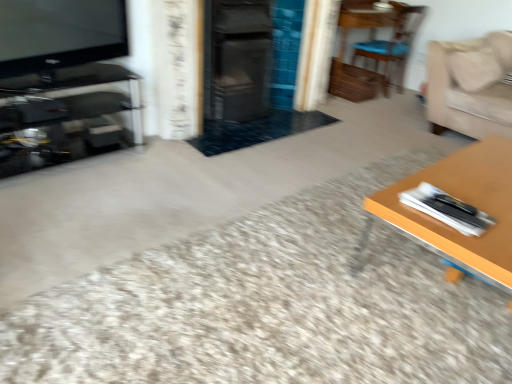
Describe the element at coordinates (470, 85) in the screenshot. I see `beige fabric couch at upper right` at that location.

This screenshot has height=384, width=512. What do you see at coordinates (62, 79) in the screenshot?
I see `black glass entertainment center at left` at bounding box center [62, 79].

Where is `wooden chair at upper right`? This screenshot has height=384, width=512. wooden chair at upper right is located at coordinates (393, 46).

Would you say wooden chair at upper right is a long distance from wooden table at right?

Indeed, wooden chair at upper right is not near wooden table at right.

Which object is positioned more to the right, wooden chair at upper right or wooden table at right?

wooden chair at upper right is more to the right.

Is wooden chair at upper right not within wooden table at right?

Yes, wooden chair at upper right is located beyond the bounds of wooden table at right.

Who is taller, wooden chair at upper right or wooden table at right?

wooden chair at upper right is taller.

Is beige fabric couch at upper right not within wooden table at right?

Yes, beige fabric couch at upper right is located beyond the bounds of wooden table at right.

Is beige fabric couch at upper right oriented towards wooden table at right?

No, beige fabric couch at upper right is not oriented towards wooden table at right.

Locate an element on the screen. table below the beige fabric couch at upper right (from the image's perspective) is located at coordinates (464, 201).

Does point (480, 52) appear closer or farther from the camera than point (490, 275)?

Point (480, 52) appears to be farther away from the viewer than point (490, 275).

Between black glass entertainment center at left and matte black tv at upper left, which one appears on the right side from the viewer's perspective?

Positioned to the right is matte black tv at upper left.

Could you tell me if black glass entertainment center at left is facing matte black tv at upper left?

No, black glass entertainment center at left is not facing towards matte black tv at upper left.

Considering the relative positions of black glass entertainment center at left and matte black tv at upper left in the image provided, is black glass entertainment center at left in front of matte black tv at upper left?

No, black glass entertainment center at left is further to the viewer.

From the image's perspective, which is below, matte black tv at upper left or wooden table at right?

wooden table at right appears lower in the image.

Consider the image. Is matte black tv at upper left placed right next to wooden table at right?

No, matte black tv at upper left is not touching wooden table at right.

Between matte black tv at upper left and wooden table at right, which one has larger size?

With larger size is wooden table at right.

Can you confirm if matte black tv at upper left is taller than wooden table at right?

Indeed, matte black tv at upper left has a greater height compared to wooden table at right.

Considering the points (125, 33) and (387, 88), which point is in front, point (125, 33) or point (387, 88)?

Positioned in front is point (125, 33).

From a real-world perspective, between matte black tv at upper left and wooden chair at upper right, who is vertically lower?

In real-world perspective, wooden chair at upper right is lower.

Is matte black tv at upper left positioned far away from wooden chair at upper right?

matte black tv at upper left is far away from wooden chair at upper right.

How different are the orientations of beige fabric couch at upper right and wooden chair at upper right in degrees?

The facing directions of beige fabric couch at upper right and wooden chair at upper right are 169 degrees apart.

From a real-world perspective, is beige fabric couch at upper right located beneath wooden chair at upper right?

Actually, beige fabric couch at upper right is physically above wooden chair at upper right in the real world.

Considering the sizes of objects beige fabric couch at upper right and wooden chair at upper right in the image provided, who is bigger, beige fabric couch at upper right or wooden chair at upper right?

wooden chair at upper right is bigger.

From the image's perspective, relative to wooden chair at upper right, is beige fabric couch at upper right above or below?

Clearly, from the image's perspective, beige fabric couch at upper right is below wooden chair at upper right.

Is beige fabric couch at upper right far away from black glass entertainment center at left?

Yes, beige fabric couch at upper right and black glass entertainment center at left are located far from each other.

Which is in front, point (508, 107) or point (52, 44)?

The point (52, 44) is more forward.

In the scene shown: From a real-world perspective, which is physically above, beige fabric couch at upper right or black glass entertainment center at left?

In real-world perspective, beige fabric couch at upper right is above.

Based on the photo, is beige fabric couch at upper right inside or outside of black glass entertainment center at left?

beige fabric couch at upper right cannot be found inside black glass entertainment center at left.

The height and width of the screenshot is (384, 512). What are the coordinates of `table on the left of wooden chair at upper right` in the screenshot? It's located at (464, 201).

The image size is (512, 384). I want to click on couch that appears on the right of wooden table at right, so click(470, 85).

Based on their spatial positions, is wooden chair at upper right or wooden table at right further from black glass entertainment center at left?

The object further to black glass entertainment center at left is wooden chair at upper right.

From the image, which object appears to be farther from beige fabric couch at upper right, matte black tv at upper left or black glass entertainment center at left?

matte black tv at upper left is positioned further to the anchor beige fabric couch at upper right.

Based on their spatial positions, is black glass entertainment center at left or beige fabric couch at upper right closer to wooden table at right?

Based on the image, beige fabric couch at upper right appears to be nearer to wooden table at right.

Based on the photo, estimate the real-world distances between objects in this image. Which object is closer to beige fabric couch at upper right, wooden chair at upper right or wooden table at right?

Among the two, wooden chair at upper right is located nearer to beige fabric couch at upper right.

Consider the image. Which object lies further to the anchor point wooden table at right, beige fabric couch at upper right or wooden chair at upper right?

wooden chair at upper right.

Looking at the image, which one is located further to wooden chair at upper right, black glass entertainment center at left or beige fabric couch at upper right?

black glass entertainment center at left is further to wooden chair at upper right.

Estimate the real-world distances between objects in this image. Which object is further from matte black tv at upper left, beige fabric couch at upper right or wooden table at right?

beige fabric couch at upper right is further to matte black tv at upper left.

Considering their positions, is wooden table at right positioned further to black glass entertainment center at left than beige fabric couch at upper right?

Based on the image, beige fabric couch at upper right appears to be further to black glass entertainment center at left.

Find the location of a particular element. The width and height of the screenshot is (512, 384). table located between black glass entertainment center at left and wooden chair at upper right in the left-right direction is located at coordinates (464, 201).

You are a GUI agent. You are given a task and a screenshot of the screen. Output one action in this format:
    pyautogui.click(x=<x>, y=<y>)
    Task: Click on the chair situated between matte black tv at upper left and beige fabric couch at upper right from left to right
    The image size is (512, 384).
    Given the screenshot: What is the action you would take?
    pyautogui.click(x=393, y=46)

This screenshot has width=512, height=384. Find the location of `television situated between black glass entertainment center at left and wooden chair at upper right from left to right`. television situated between black glass entertainment center at left and wooden chair at upper right from left to right is located at coordinates [59, 34].

Identify the location of table between matte black tv at upper left and beige fabric couch at upper right from left to right. The image size is (512, 384). (464, 201).